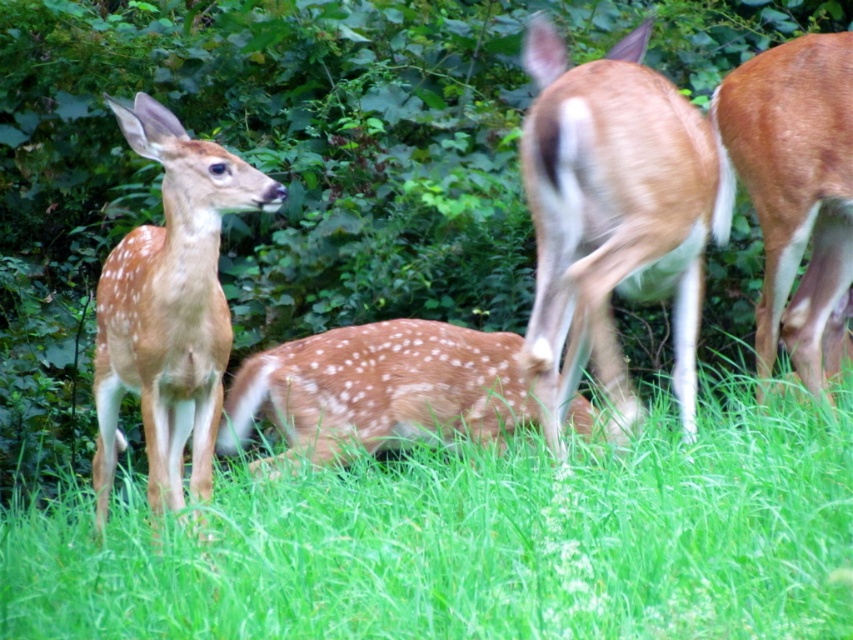
Question: Is spotted fur deer at left above spotted fur deer at center?

Choices:
 (A) no
 (B) yes

Answer: (B)

Question: Does green grassy at lower center appear on the right side of brown matte fur at right?

Choices:
 (A) yes
 (B) no

Answer: (B)

Question: Which of the following is the farthest from the observer?

Choices:
 (A) spotted fur deer at center
 (B) brown speckled fur at center
 (C) brown matte fur at right

Answer: (A)

Question: Which object is farther from the camera taking this photo?

Choices:
 (A) brown speckled fur at center
 (B) spotted fur deer at center
 (C) green grassy at lower center

Answer: (B)

Question: Which object appears closest to the camera in this image?

Choices:
 (A) brown speckled fur at center
 (B) spotted fur deer at center
 (C) brown matte fur at right

Answer: (A)

Question: Observing the image, what is the correct spatial positioning of green grassy at lower center in reference to spotted fur deer at left?

Choices:
 (A) left
 (B) right

Answer: (B)